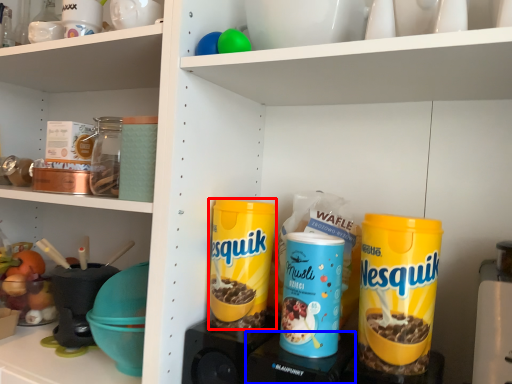
Question: Which of the following is the farthest to the observer, cereal (highlighted by a red box) or appliance (highlighted by a blue box)?

Choices:
 (A) cereal
 (B) appliance

Answer: (A)